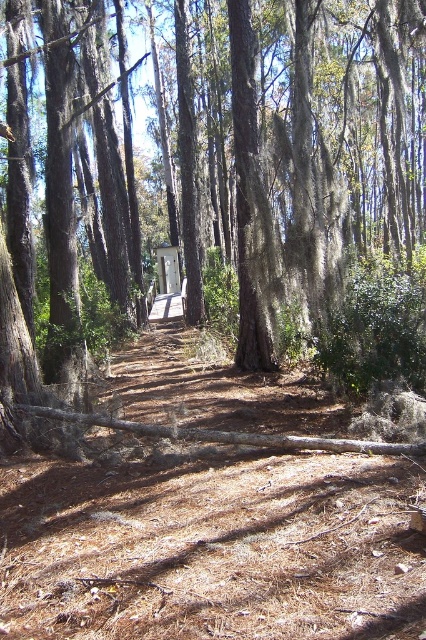
Question: Is brown rough tree at center to the right of white wood gazebo at center from the viewer's perspective?

Choices:
 (A) no
 (B) yes

Answer: (B)

Question: Where is brown rough tree at center located in relation to white wood gazebo at center in the image?

Choices:
 (A) below
 (B) above

Answer: (B)

Question: Can you confirm if brown rough tree at center is positioned above brown dirt trail at center?

Choices:
 (A) no
 (B) yes

Answer: (B)

Question: Which point is farther to the camera?

Choices:
 (A) (299, 120)
 (B) (169, 260)
 (C) (160, 372)

Answer: (B)

Question: Which of the following is the closest to the observer?

Choices:
 (A) (359, 1)
 (B) (163, 276)
 (C) (199, 362)

Answer: (C)

Question: Which point is farther from the camera taking this photo?

Choices:
 (A) (167, 266)
 (B) (417, 234)

Answer: (A)